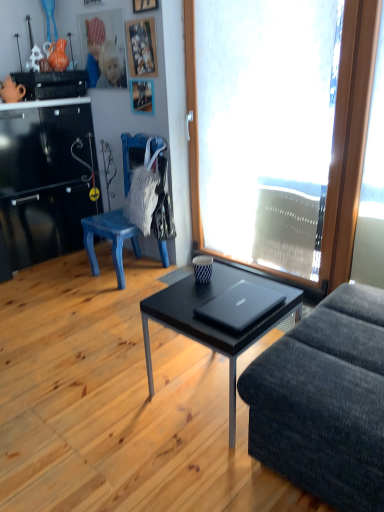
You are a GUI agent. You are given a task and a screenshot of the screen. Output one action in this format:
    pyautogui.click(x=<x>, y=<y>)
    Task: Click on the free space above black matte coffee table at center (from a real-world perspective)
    The height and width of the screenshot is (512, 384).
    Given the screenshot: What is the action you would take?
    pyautogui.click(x=226, y=301)